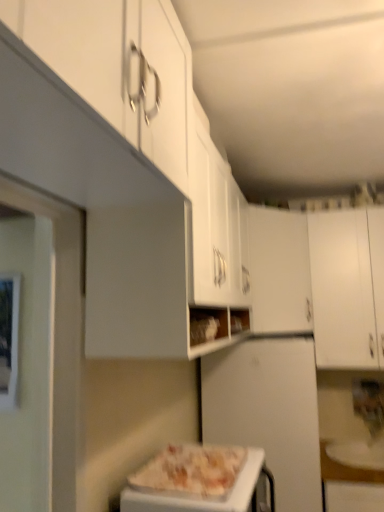
This screenshot has height=512, width=384. In order to click on empty space that is ontop of white glossy pizza at center in this screenshot , I will do `click(213, 464)`.